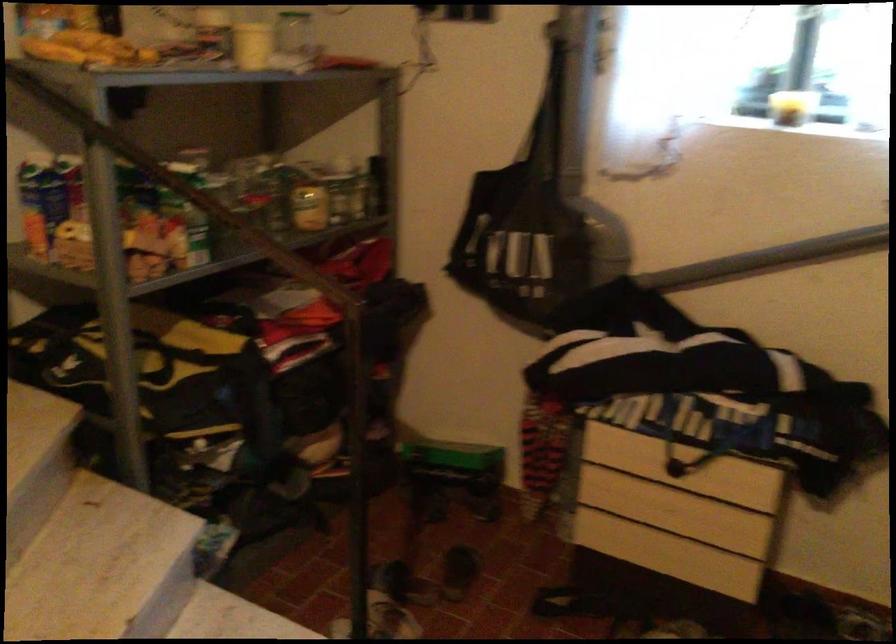
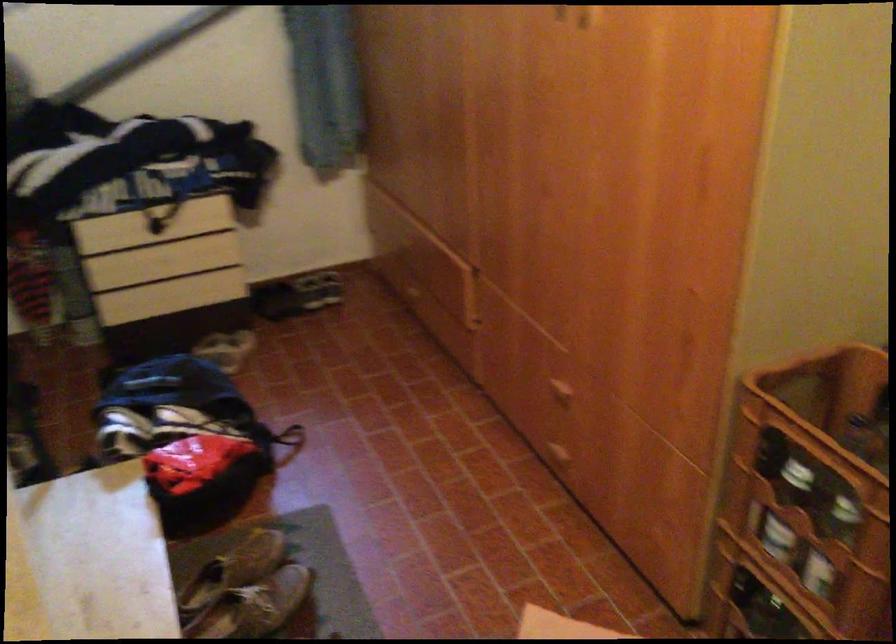
The first image is from the beginning of the video and the second image is from the end. How did the camera likely rotate when shooting the video?

The camera's rotation is toward right-down.